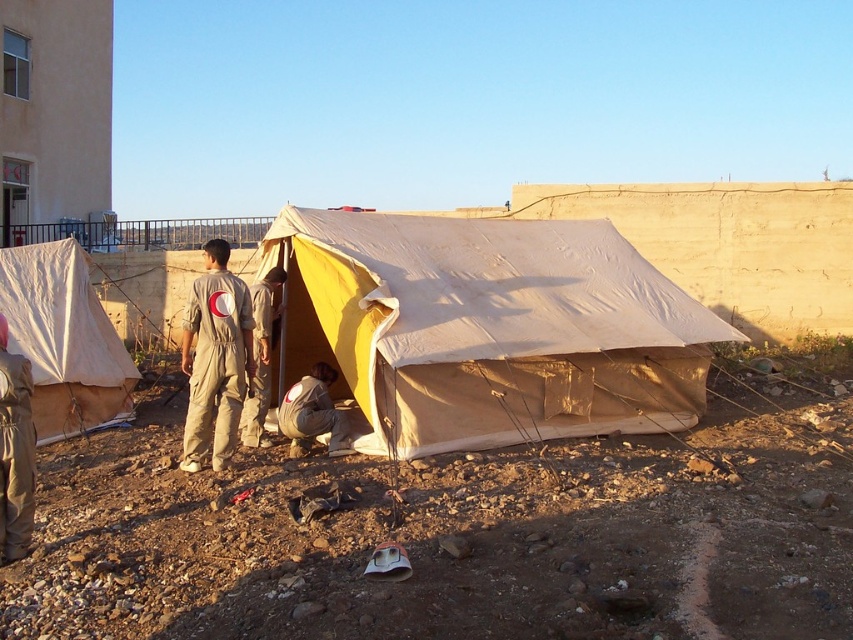
Question: Based on their relative distances, which object is nearer to the beige fabric jumpsuit at center?

Choices:
 (A) khaki cotton jumpsuit at center
 (B) beige canvas tent at center

Answer: (A)

Question: From the image, what is the correct spatial relationship of beige fabric jumpsuit at center in relation to khaki uniform at center?

Choices:
 (A) above
 (B) below

Answer: (A)

Question: Which object appears farthest from the camera in this image?

Choices:
 (A) beige fabric jumpsuit at center
 (B) khaki uniform at center

Answer: (B)

Question: Does white canvas tent at lower left come in front of khaki uniform at center?

Choices:
 (A) no
 (B) yes

Answer: (A)

Question: Can you confirm if beige fabric jumpsuit at center is wider than khaki cotton jumpsuit at center?

Choices:
 (A) no
 (B) yes

Answer: (B)

Question: Which of the following is the farthest from the observer?

Choices:
 (A) (547, 337)
 (B) (49, 321)
 (C) (225, 241)
 (D) (270, 301)

Answer: (B)